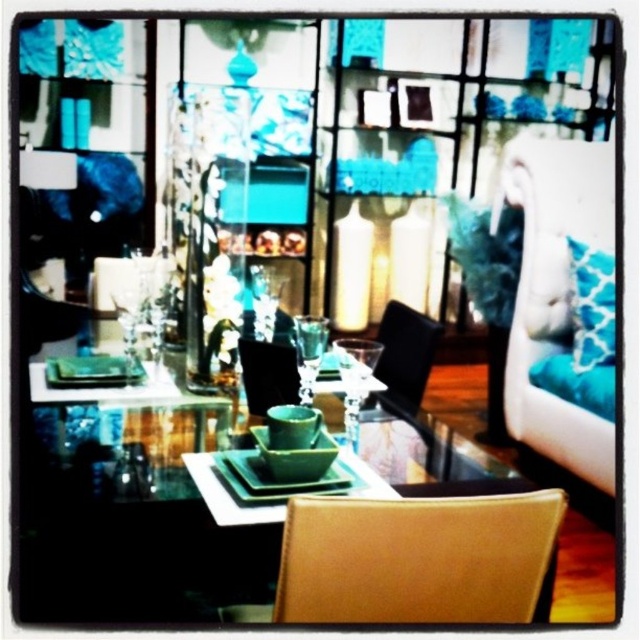
You are planning to place a rectangular tray that is 1.2 meters wide on the dining table. The tray must be placed between the black leather chair at center and the teal fabric pillow at right. Given their widths, will the tray fit between them without overlapping?

The black leather chair at center is wider than the teal fabric pillow at right. Since the tray is 1.2 meters wide, and the space between them must accommodate this width, but the exact distance isn

You are arranging a dinner party and need to place a centerpiece on the table. You have the green glossy square plate at center and the leather chair at lower right in view. Which object has a greater width?

The green glossy square plate at center has a greater width than the leather chair at lower right.

You are planning to place a new rectangular side table next to the leather chair at lower right and the teal fabric pillow at right. Based on their sizes, which object should you place the table next to to ensure it fits comfortably?

The leather chair at lower right might be wider than the teal fabric pillow at right, so placing the table next to the teal fabric pillow at right would likely provide more space for the table to fit comfortably.